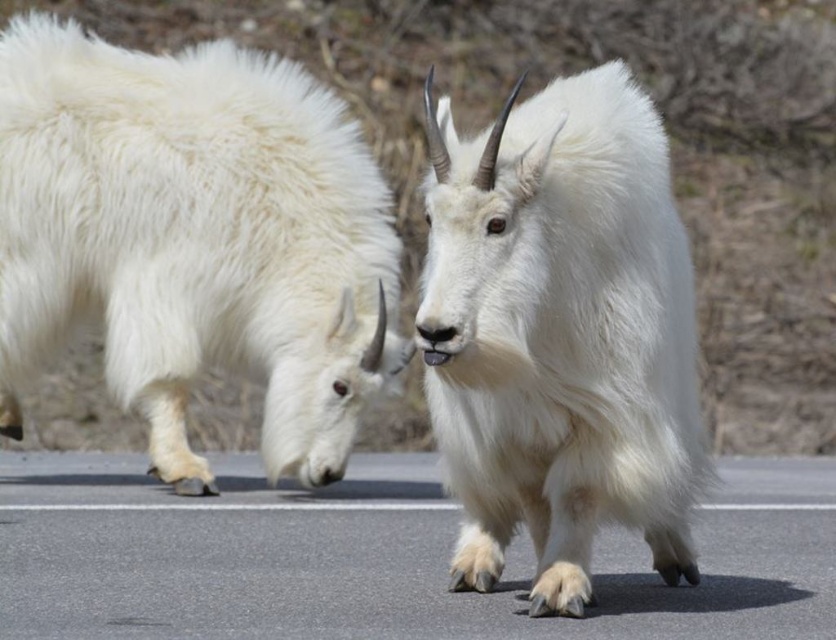
You are a wildlife photographer aiming to capture a closeup of the white fluffy goat at left and the white fluffy goat at center. Since you want both goats in the frame, which goat should you focus on first to ensure both are in focus?

You should focus on the white fluffy goat at left first because it is bigger, which means it is closer to the camera than the white fluffy goat at center. By focusing on the closer goat, both will be in focus as the depth of field will cover the distance between them.

You are a hiker on the road and want to take a photo of both the white fluffy goat at left and the white fluffy goat at center. Since you can only focus on one goat at a time, which goat should you focus on to ensure the other is still in the background?

You should focus on the white fluffy goat at left because it is above the white fluffy goat at center, so the latter will be in the background.

From the picture: You are a hiker on a mountain trail and see two white fluffy goats on the road ahead. The white fluffy goat at left and the white fluffy goat at center are blocking your path. Which goat is closer to you?

The white fluffy goat at left is closer to you because the white fluffy goat at center is behind it.